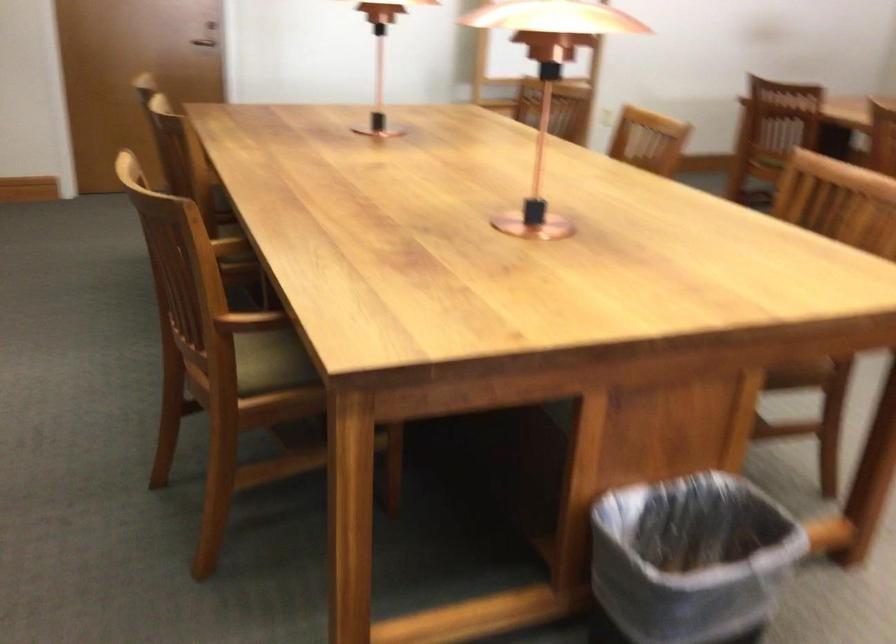
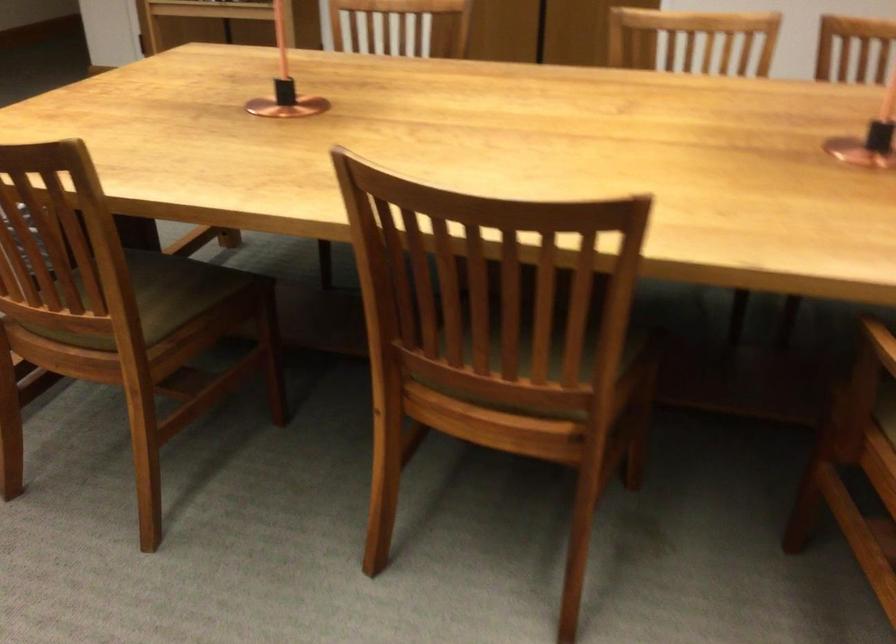
Question: I am providing you with two images of the same scene from different viewpoints. Please identify which objects are invisible in image2.

Choices:
 (A) wooden chair armrest
 (B) black brake lever
 (C) copper table object
 (D) green chair sitting surface

Answer: (A)